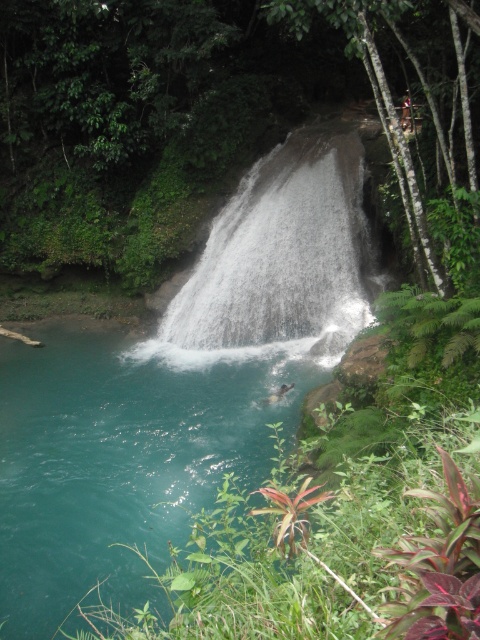
Which of these two, teal glossy water at center or white textured waterfall at center, stands taller?

teal glossy water at center

Between point (67, 476) and point (333, 352), which one is positioned in front?

Point (67, 476)

Who is more forward, (41,401) or (193,321)?

Point (41,401)

Locate an element on the screen. Image resolution: width=480 pixels, height=640 pixels. teal glossy water at center is located at coordinates (121, 456).